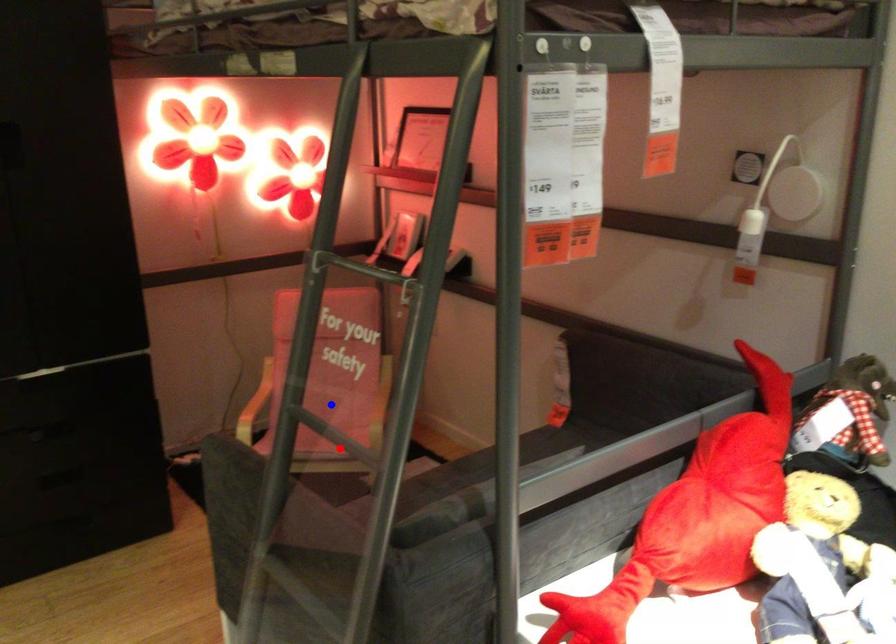
Question: Which of the two points in the image is closer to the camera?

Choices:
 (A) Blue point is closer.
 (B) Red point is closer.

Answer: (B)